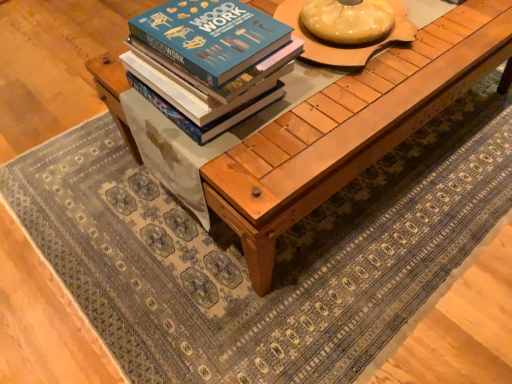
Identify the location of blue matte book at center. The width and height of the screenshot is (512, 384). (209, 62).

Is blue matte book at center oriented towards natural wood table at center?

No, blue matte book at center is not oriented towards natural wood table at center.

Is blue matte book at center not within natural wood table at center?

Yes, blue matte book at center is located beyond the bounds of natural wood table at center.

Does point (224, 98) appear closer or farther from the camera than point (293, 216)?

Clearly, point (224, 98) is closer to the camera than point (293, 216).

Is blue matte book at center positioned far away from natural wood table at center?

Actually, blue matte book at center and natural wood table at center are a little close together.

Between natural wood table at center and blue matte book at center, which one has smaller size?

blue matte book at center.

Does natural wood table at center have a lesser height compared to blue matte book at center?

Incorrect, the height of natural wood table at center does not fall short of that of blue matte book at center.

This screenshot has height=384, width=512. Find the location of `table behind the blue matte book at center`. table behind the blue matte book at center is located at coordinates (354, 131).

Is point (294, 214) positioned after point (340, 50)?

No, (294, 214) is closer to viewer.

From a real-world perspective, is natural wood table at center positioned above or below matte wooden round table at center?

In terms of real-world spatial position, natural wood table at center is below matte wooden round table at center.

Looking at this image, between natural wood table at center and matte wooden round table at center, which one has smaller width?

With smaller width is matte wooden round table at center.

From the image's perspective, is natural wood table at center located above or below matte wooden round table at center?

natural wood table at center is below matte wooden round table at center.

Considering the relative positions of matte wooden round table at center and blue matte book at center in the image provided, is matte wooden round table at center to the right of blue matte book at center from the viewer's perspective?

Yes, matte wooden round table at center is to the right of blue matte book at center.

Considering the relative sizes of matte wooden round table at center and blue matte book at center in the image provided, is matte wooden round table at center bigger than blue matte book at center?

Yes.

Is point (414, 39) closer or farther from the camera than point (221, 97)?

Clearly, point (414, 39) is more distant from the camera than point (221, 97).

Does matte wooden round table at center have a greater height compared to blue matte book at center?

Correct, matte wooden round table at center is much taller as blue matte book at center.

Which object is further away from the camera taking this photo, matte wooden round table at center or natural wood table at center?

matte wooden round table at center is behind.

Is matte wooden round table at center facing away from natural wood table at center?

matte wooden round table at center does not have its back to natural wood table at center.

Does matte wooden round table at center have a lesser width compared to natural wood table at center?

Indeed, matte wooden round table at center has a lesser width compared to natural wood table at center.

Is blue matte book at center with matte wooden round table at center?

They are not placed beside each other.

In the image, there is a matte wooden round table at center. Identify the location of book below it (from the image's perspective). This screenshot has height=384, width=512. (209, 62).

From a real-world perspective, is blue matte book at center beneath matte wooden round table at center?

Yes, from a real-world perspective, blue matte book at center is under matte wooden round table at center.

The image size is (512, 384). Identify the location of book above the natural wood table at center (from a real-world perspective). (209, 62).

Identify the location of table located behind the blue matte book at center. (354, 131).

Looking at the image, which one is located closer to matte wooden round table at center, blue matte book at center or natural wood table at center?

natural wood table at center is closer to matte wooden round table at center.

Which object lies further to the anchor point natural wood table at center, matte wooden round table at center or blue matte book at center?

Among the two, blue matte book at center is located further to natural wood table at center.

Based on their spatial positions, is natural wood table at center or blue matte book at center further from matte wooden round table at center?

Based on the image, blue matte book at center appears to be further to matte wooden round table at center.

From the image, which object appears to be nearer to blue matte book at center, natural wood table at center or matte wooden round table at center?

natural wood table at center.

Consider the image. Based on their spatial positions, is blue matte book at center or matte wooden round table at center closer to natural wood table at center?

Among the two, matte wooden round table at center is located nearer to natural wood table at center.

Looking at this image, from the image, which object appears to be farther from blue matte book at center, matte wooden round table at center or natural wood table at center?

matte wooden round table at center.

Locate an element on the screen. round table between blue matte book at center and natural wood table at center is located at coordinates (343, 48).